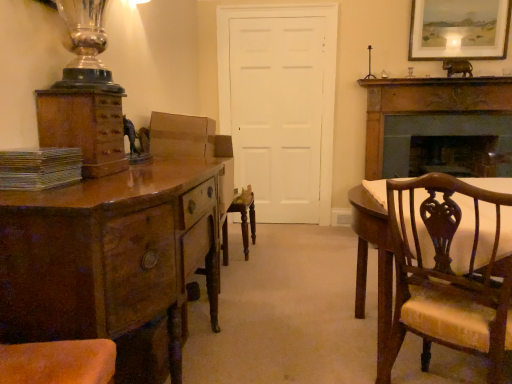
Locate an element on the screen. The width and height of the screenshot is (512, 384). vacant space situated above dark brown wood fireplace at right (from a real-world perspective) is located at coordinates (435, 89).